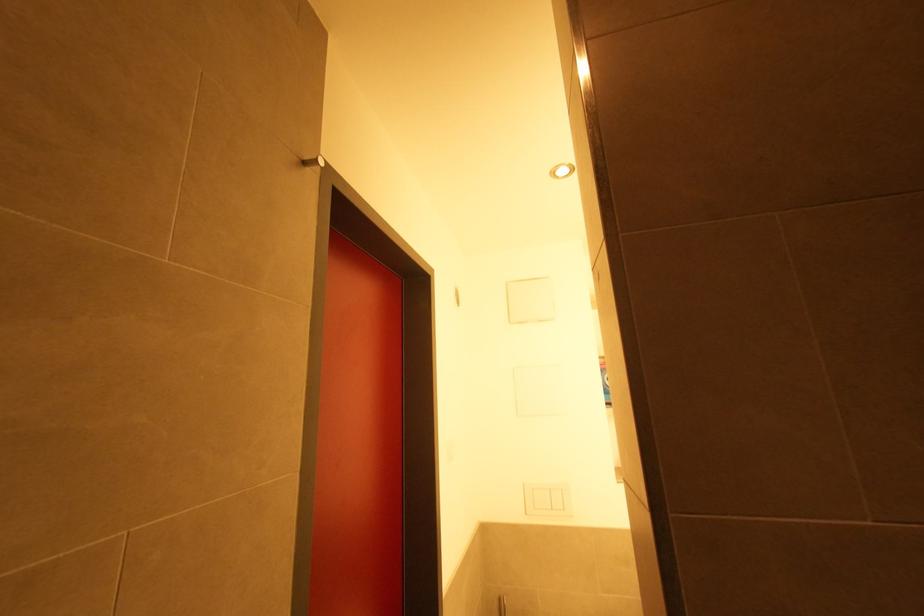
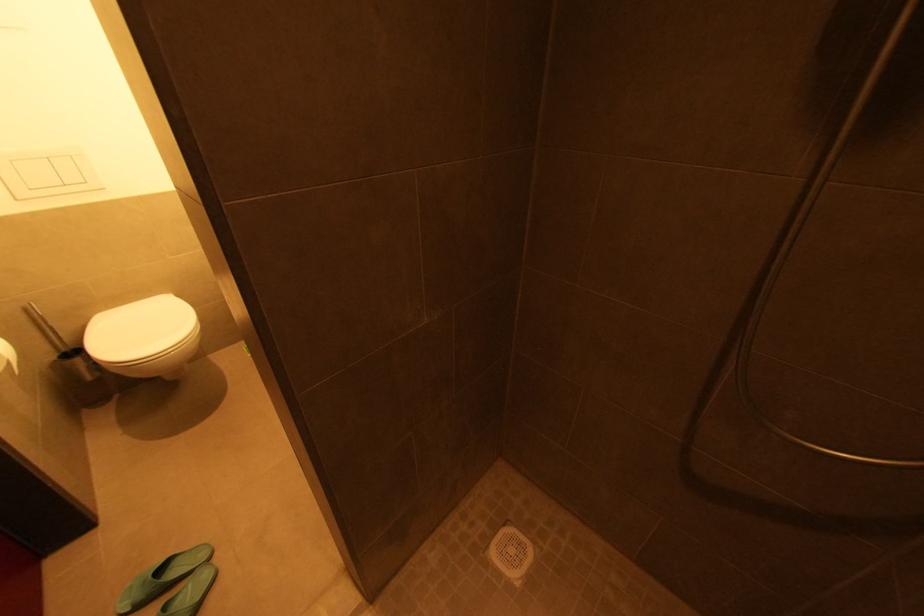
How did the camera likely rotate?

The camera's rotation is toward right-down.